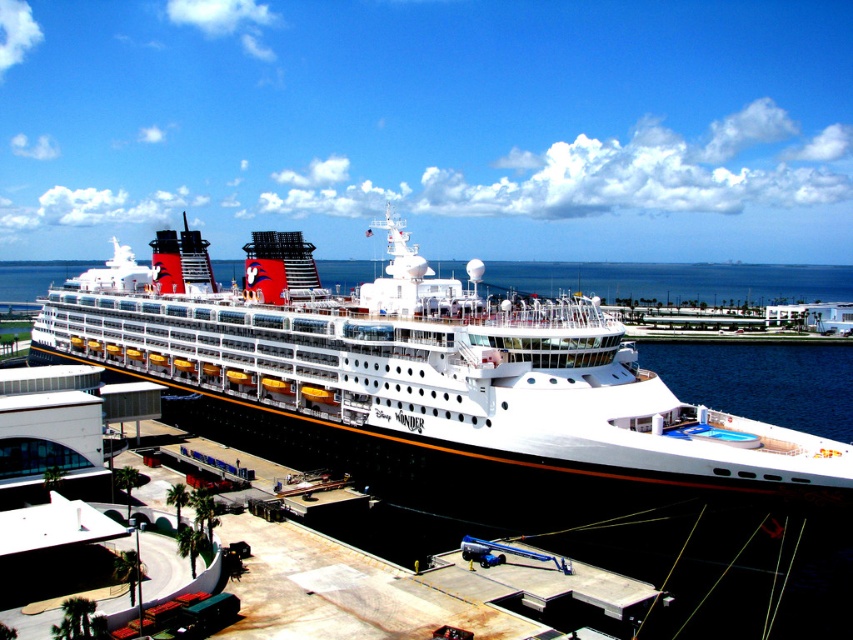
You are on a boat near the white glossy cruise ship at center and want to know if you can see the blue water at center from your current position. Based on the scene, can you see it?

The white glossy cruise ship at center is located below blue water at center, so yes, you can see the blue water at center from your position as it is above the cruise ship.

You are standing at the coordinates 0.5, 0.5 in the image. You want to locate the white glossy cruise ship at center. In which direction should you move to face it?

Since the white glossy cruise ship at center is located at point (421, 381) and you are at (426, 320), you should move slightly to the right and down to face it.

You are standing on the dock and looking at the white glossy cruise ship at center and the blue water at center. Which object is nearer to you?

The white glossy cruise ship at center is closer to the viewer than the blue water at center, so the white glossy cruise ship at center is nearer to you.